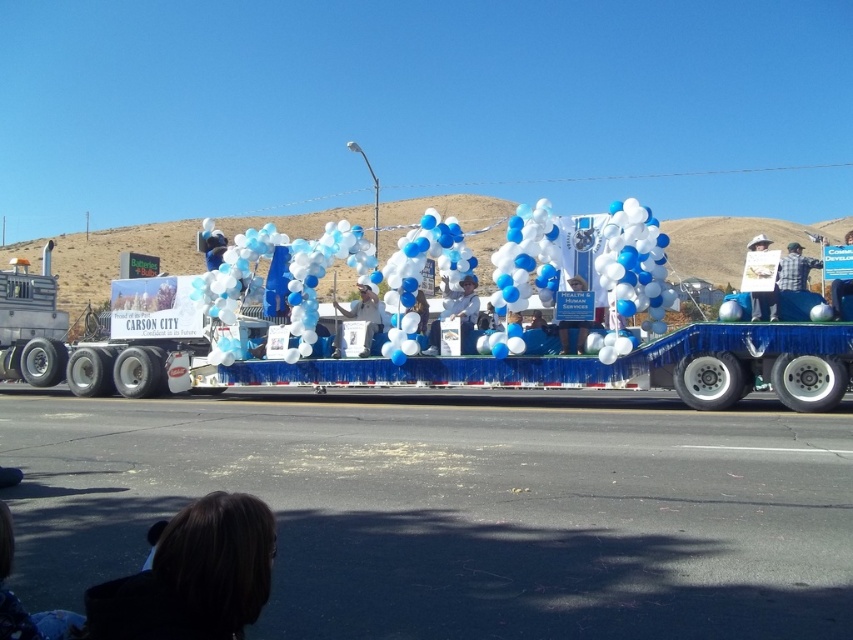
Looking at this image, is white paper sign at upper right thinner than white paper sign at center?

Yes, white paper sign at upper right is thinner than white paper sign at center.

Who is lower down, white paper sign at upper right or white paper sign at center?

Positioned lower is white paper sign at upper right.

Does point (764, 304) come behind point (830, 285)?

Yes.

The height and width of the screenshot is (640, 853). I want to click on white paper sign at upper right, so click(764, 304).

Find the location of a particular element. dark brown hair at lower left is located at coordinates (193, 577).

Can you confirm if dark brown hair at lower left is positioned above white cloth at center?

Incorrect, dark brown hair at lower left is not positioned above white cloth at center.

This screenshot has height=640, width=853. Describe the element at coordinates (193, 577) in the screenshot. I see `dark brown hair at lower left` at that location.

Where is `dark brown hair at lower left`? dark brown hair at lower left is located at coordinates (193, 577).

Which is below, blue glossy balloons at center or white paper sign at upper right?

blue glossy balloons at center is lower down.

How much distance is there between blue glossy balloons at center and white paper sign at upper right?

blue glossy balloons at center is 5.92 meters from white paper sign at upper right.

Who is more distant from viewer, (607, 288) or (747, 246)?

Positioned behind is point (607, 288).

This screenshot has height=640, width=853. I want to click on blue glossy balloons at center, so click(329, 266).